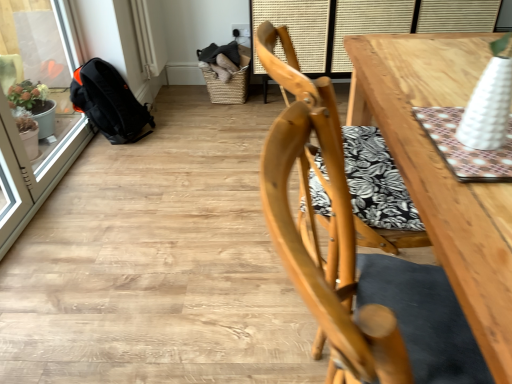
The width and height of the screenshot is (512, 384). Identify the location of free space between light wood chair at center and black fabric backpack at left. (186, 195).